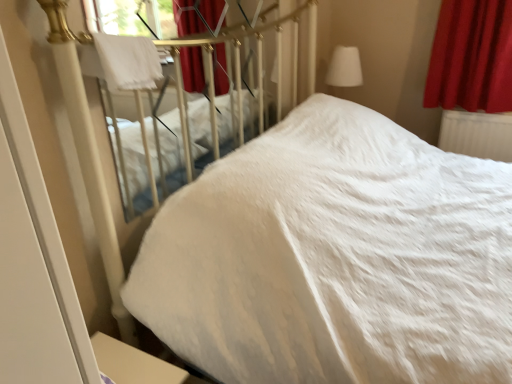
Question: Which direction should I rotate to look at white soft bed at center, which appears as the second bed when viewed from the left, — up or down?

Choices:
 (A) up
 (B) down

Answer: (A)

Question: Is velvet red curtain at upper right not inside white fabric lampshade at upper right?

Choices:
 (A) no
 (B) yes

Answer: (B)

Question: Is velvet red curtain at upper right behind white fabric lampshade at upper right?

Choices:
 (A) yes
 (B) no

Answer: (B)

Question: Is velvet red curtain at upper right thinner than white fabric lampshade at upper right?

Choices:
 (A) yes
 (B) no

Answer: (A)

Question: Can you see velvet red curtain at upper right touching white fabric lampshade at upper right?

Choices:
 (A) no
 (B) yes

Answer: (A)

Question: Is velvet red curtain at upper right closer to camera compared to white fabric lampshade at upper right?

Choices:
 (A) no
 (B) yes

Answer: (B)

Question: Is velvet red curtain at upper right at the left side of white fabric lampshade at upper right?

Choices:
 (A) yes
 (B) no

Answer: (B)

Question: Considering the relative positions of white fluffy blanket at upper left and velvet red curtain at upper right in the image provided, is white fluffy blanket at upper left behind velvet red curtain at upper right?

Choices:
 (A) yes
 (B) no

Answer: (B)

Question: Is white fluffy blanket at upper left not close to velvet red curtain at upper right?

Choices:
 (A) yes
 (B) no

Answer: (A)

Question: Can you confirm if white fluffy blanket at upper left is positioned to the left of velvet red curtain at upper right?

Choices:
 (A) no
 (B) yes

Answer: (B)

Question: Is white fluffy blanket at upper left turned away from velvet red curtain at upper right?

Choices:
 (A) no
 (B) yes

Answer: (A)

Question: Does white fluffy blanket at upper left come in front of velvet red curtain at upper right?

Choices:
 (A) no
 (B) yes

Answer: (B)

Question: Is white fluffy blanket at upper left taller than velvet red curtain at upper right?

Choices:
 (A) yes
 (B) no

Answer: (B)

Question: From a real-world perspective, is white soft bed at upper left, the second bed viewed from the right, physically below white plastic radiator at right?

Choices:
 (A) yes
 (B) no

Answer: (B)